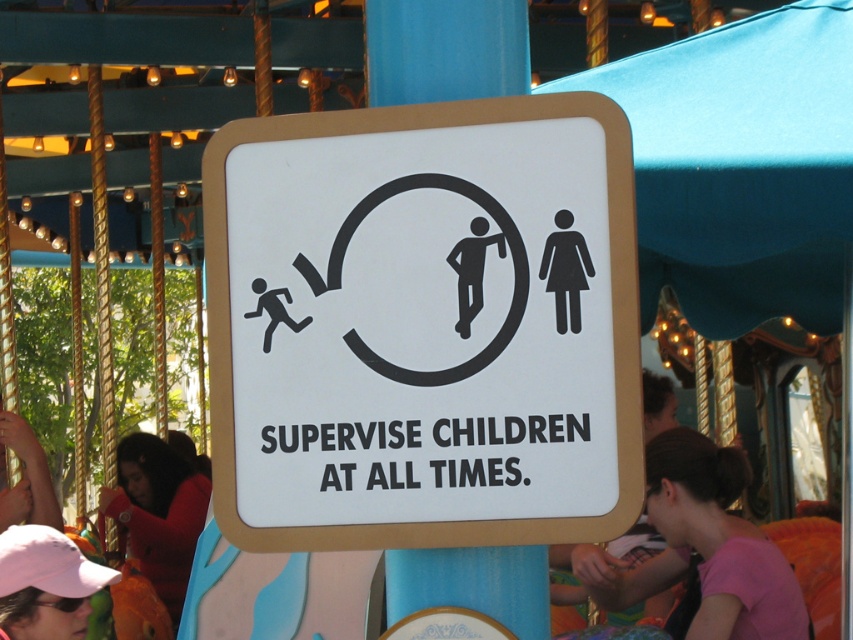
You are at an amusement park and see the sign with a red shirt at lower left and a pink fabric cap at lower left. Which item is wider?

The red shirt at lower left might be wider than pink fabric cap at lower left according to the description.

You are standing at the carousel and see two points marked in the image. Which point is closer to you, the point at coordinate (721, 588) or the point at (122, 499)?

Point (721, 588) is in front of point (122, 499), so the point at coordinate (721, 588) is closer to you.